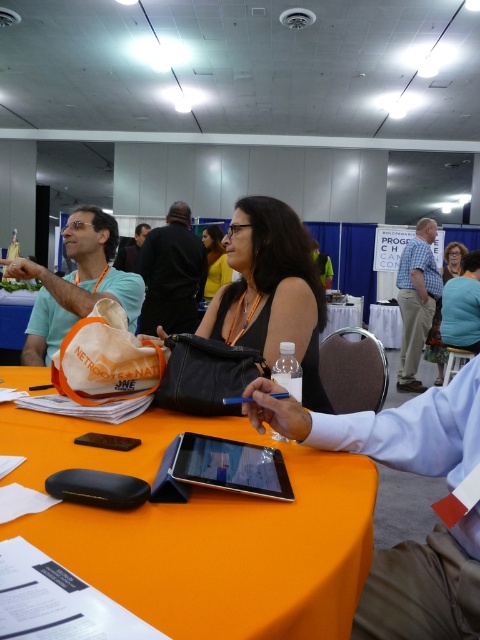
Is point (183, 332) less distant than point (455, 273)?

Yes, it is in front of point (455, 273).

This screenshot has width=480, height=640. What do you see at coordinates (171, 275) in the screenshot?
I see `black fabric jacket at center` at bounding box center [171, 275].

You are a GUI agent. You are given a task and a screenshot of the screen. Output one action in this format:
    pyautogui.click(x=<x>, y=<y>)
    Task: Click on the black fabric jacket at center
    The width and height of the screenshot is (480, 640).
    Given the screenshot: What is the action you would take?
    pyautogui.click(x=171, y=275)

Can you confirm if matte light blue shirt at upper left is positioned to the right of black fabric jacket at center?

No, matte light blue shirt at upper left is not to the right of black fabric jacket at center.

Which is more to the left, matte light blue shirt at upper left or black fabric jacket at center?

From the viewer's perspective, matte light blue shirt at upper left appears more on the left side.

In order to click on matte light blue shirt at upper left in this screenshot , I will do `click(76, 284)`.

Which is more to the right, checkered fabric shirt at upper right or matte black tank top at center?

From the viewer's perspective, checkered fabric shirt at upper right appears more on the right side.

Does checkered fabric shirt at upper right appear on the left side of matte black tank top at center?

Incorrect, checkered fabric shirt at upper right is not on the left side of matte black tank top at center.

Measure the distance between checkered fabric shirt at upper right and camera.

They are 4.35 meters apart.

At what (x,y) coordinates should I click in order to perform the action: click on checkered fabric shirt at upper right. Please return your answer as a coordinate pair (x, y). Looking at the image, I should click on (417, 300).